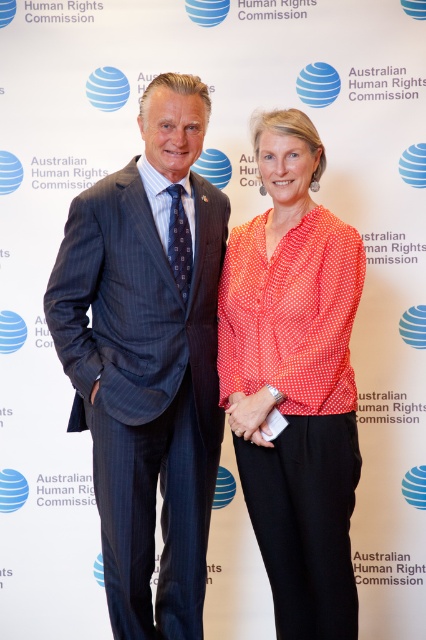
Is dark blue pinstripe suit at center below polka dot blouse at center?

No.

Between dark blue pinstripe suit at center and polka dot blouse at center, which one is positioned lower?

polka dot blouse at center

The height and width of the screenshot is (640, 426). Describe the element at coordinates (147, 360) in the screenshot. I see `dark blue pinstripe suit at center` at that location.

In order to click on dark blue pinstripe suit at center in this screenshot , I will do `click(147, 360)`.

In the scene shown: Between polka dot blouse at center and matte red blouse at center, which one appears on the left side from the viewer's perspective?

matte red blouse at center

Is polka dot blouse at center thinner than matte red blouse at center?

No, polka dot blouse at center is not thinner than matte red blouse at center.

Image resolution: width=426 pixels, height=640 pixels. I want to click on polka dot blouse at center, so (x=296, y=380).

The image size is (426, 640). In order to click on polka dot blouse at center in this screenshot , I will do `click(296, 380)`.

Between dark blue pinstripe suit at center and matte red blouse at center, which one has more height?

Standing taller between the two is dark blue pinstripe suit at center.

Who is positioned more to the right, dark blue pinstripe suit at center or matte red blouse at center?

matte red blouse at center is more to the right.

Find the location of a particular element. This screenshot has width=426, height=640. dark blue pinstripe suit at center is located at coordinates (147, 360).

Identify the location of dark blue pinstripe suit at center. (147, 360).